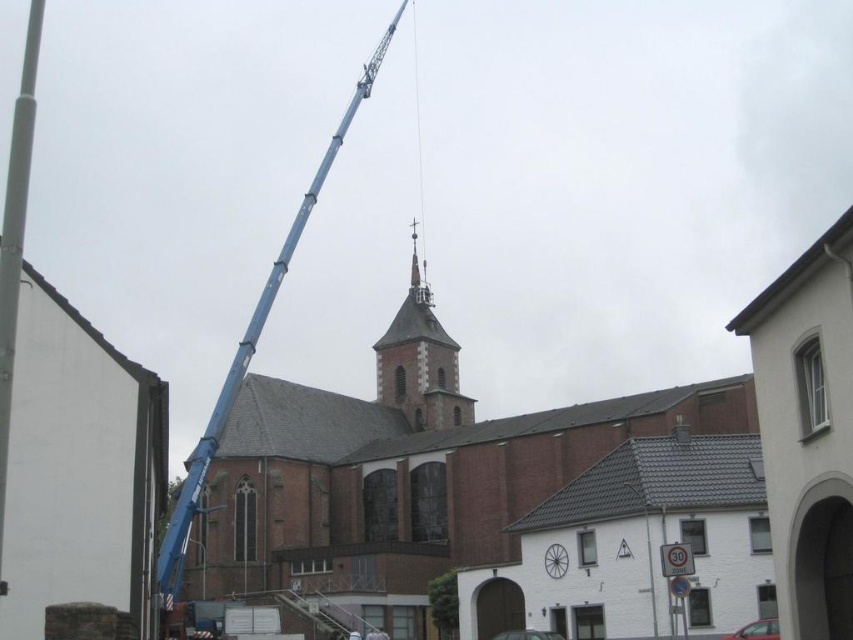
Question: Which object is positioned farthest from the blue metallic crane at upper left?

Choices:
 (A) smooth brown leather belt at center
 (B) smooth stone tower at center

Answer: (A)

Question: Can you confirm if brick church at center is positioned to the left of blue metallic crane at upper left?

Choices:
 (A) yes
 (B) no

Answer: (B)

Question: Which point is farther from the camera taking this photo?

Choices:
 (A) (430, 301)
 (B) (379, 632)
 (C) (247, 484)

Answer: (A)

Question: Is brick church at center to the right of smooth white pole at left from the viewer's perspective?

Choices:
 (A) yes
 (B) no

Answer: (A)

Question: Can you confirm if blue metallic crane at upper left is positioned above smooth stone tower at center?

Choices:
 (A) no
 (B) yes

Answer: (B)

Question: Among these points, which one is nearest to the camera?

Choices:
 (A) (384, 634)
 (B) (314, 620)
 (C) (10, 260)
 (D) (357, 96)

Answer: (C)